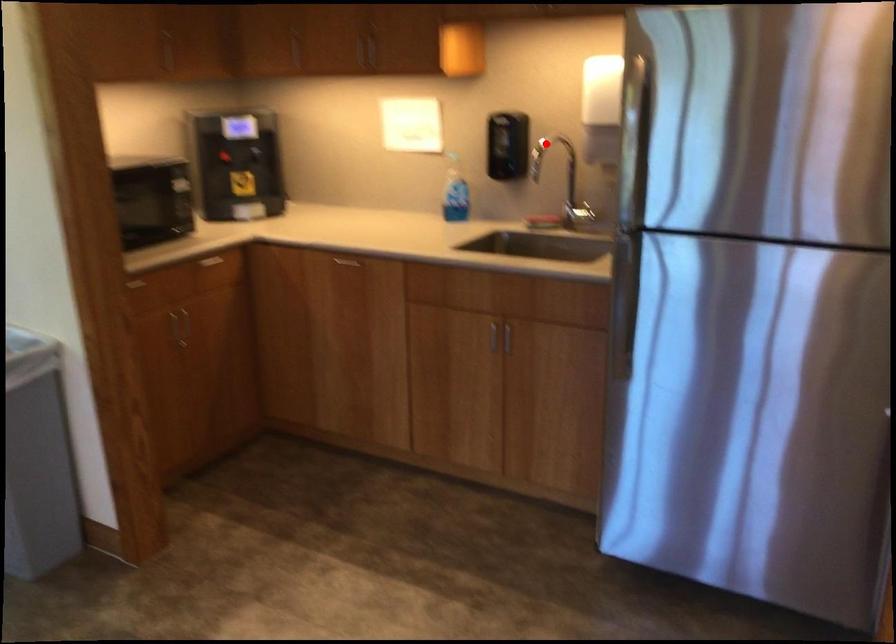
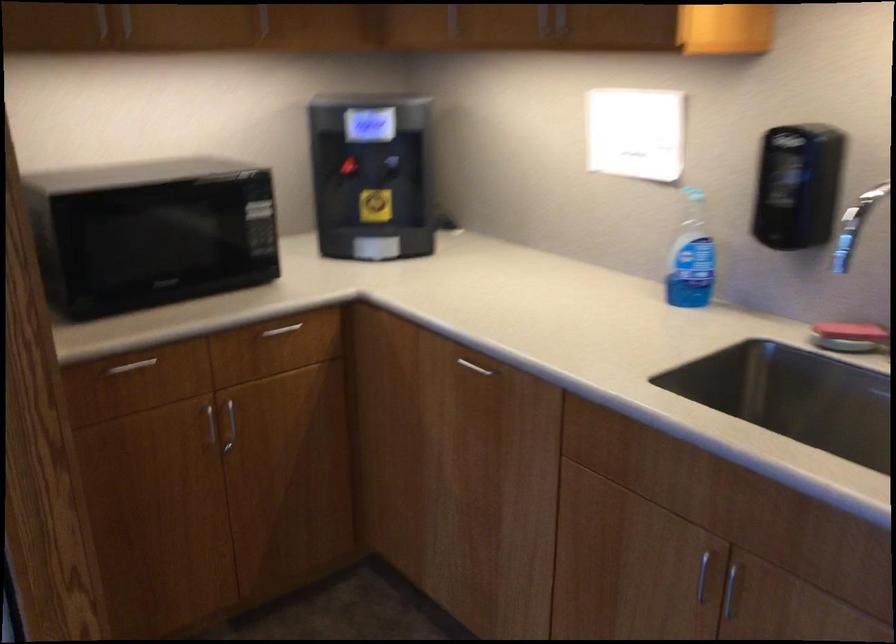
Question: I am providing you with two images of the same scene from different viewpoints. Given a red point in image1, look at the same physical point in image2. Is it:

Choices:
 (A) Closer to the viewpoint
 (B) Farther from the viewpoint

Answer: (A)